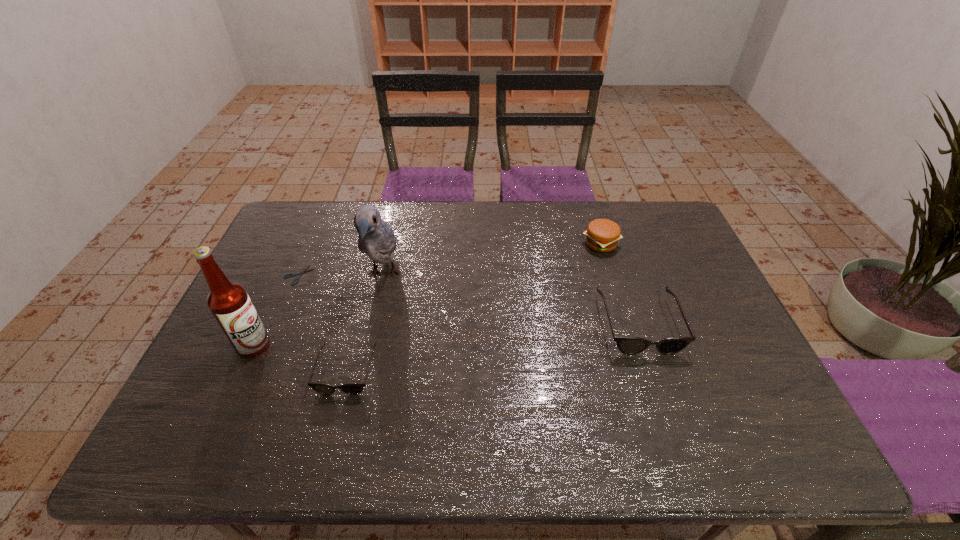
The height and width of the screenshot is (540, 960). In order to click on vacant region at the right edge of the desktop in this screenshot , I will do `click(646, 257)`.

Find the location of a particular element. The image size is (960, 540). free region at the far left corner is located at coordinates (279, 227).

Find the location of a particular element. Image resolution: width=960 pixels, height=540 pixels. free space at the near right corner of the desktop is located at coordinates (756, 397).

Where is `vacant region between the shears and the second shortest object`? vacant region between the shears and the second shortest object is located at coordinates (323, 323).

At what (x,y) coordinates should I click in order to perform the action: click on empty space that is in between the alcohol and the hamburger. Please return your answer as a coordinate pair (x, y). This screenshot has width=960, height=540. Looking at the image, I should click on (427, 294).

The width and height of the screenshot is (960, 540). Identify the location of free spot between the right sunglasses and the alcohol. (446, 334).

Locate an element on the screen. The height and width of the screenshot is (540, 960). empty space between the shears and the left sunglasses is located at coordinates (323, 323).

At what (x,y) coordinates should I click in order to perform the action: click on free spot between the shears and the second shortest object. Please return your answer as a coordinate pair (x, y). Looking at the image, I should click on (323, 323).

I want to click on free space between the parrot and the taller sunglasses, so click(x=511, y=299).

The height and width of the screenshot is (540, 960). Find the location of `vacant space that's between the alcohol and the parrot`. vacant space that's between the alcohol and the parrot is located at coordinates [319, 309].